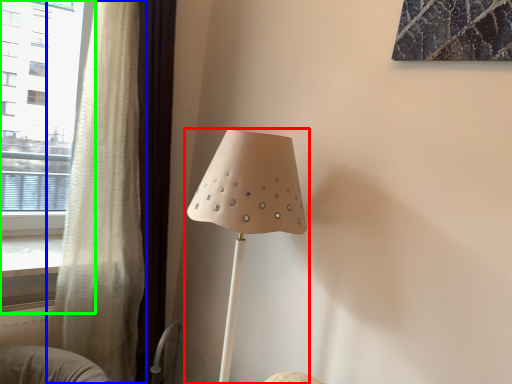
Question: Estimate the real-world distances between objects in this image. Which object is closer to lamp (highlighted by a red box), curtain (highlighted by a blue box) or window (highlighted by a green box)?

Choices:
 (A) curtain
 (B) window

Answer: (A)